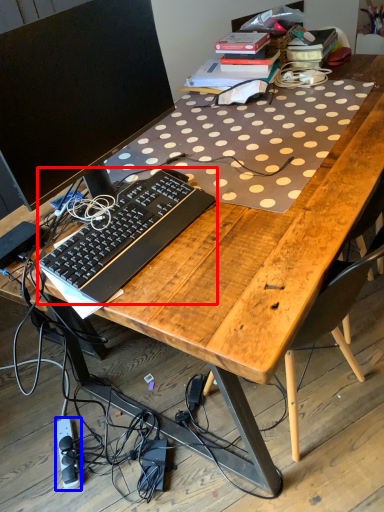
Question: Among these objects, which one is nearest to the camera, computer keyboard (highlighted by a red box) or equipment (highlighted by a blue box)?

Choices:
 (A) computer keyboard
 (B) equipment

Answer: (A)